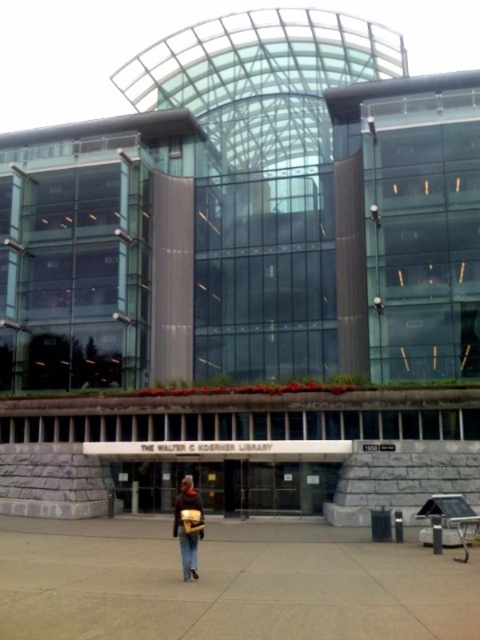
Can you confirm if denim at lower center is positioned above brown matte jacket at lower center?

Yes.

Is denim at lower center taller than brown matte jacket at lower center?

Incorrect, denim at lower center's height is not larger of brown matte jacket at lower center's.

Does point (187, 577) come closer to viewer compared to point (193, 486)?

Yes, point (187, 577) is in front of point (193, 486).

Locate an element on the screen. This screenshot has height=640, width=480. denim at lower center is located at coordinates (189, 552).

Is leather backpack at center taller than denim at lower center?

Correct, leather backpack at center is much taller as denim at lower center.

Is point (177, 534) closer to camera compared to point (188, 545)?

No, (177, 534) is further to viewer.

Is point (184, 541) positioned behind point (191, 547)?

Yes, it is behind point (191, 547).

Where is `leather backpack at center`? leather backpack at center is located at coordinates (190, 525).

Which is more to the left, leather backpack at center or brown matte jacket at lower center?

Positioned to the left is brown matte jacket at lower center.

Where is `leather backpack at center`? leather backpack at center is located at coordinates (190, 525).